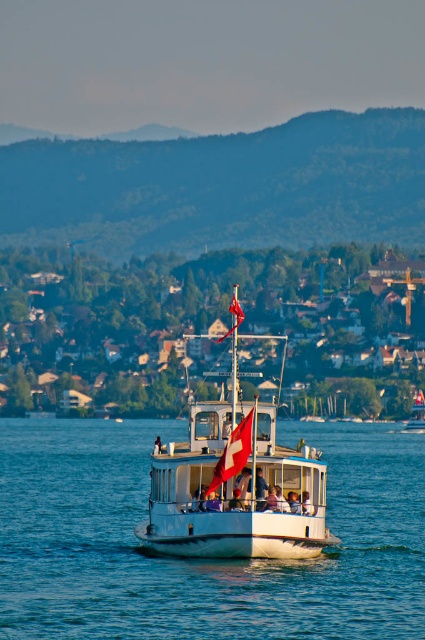
Question: Which of the following is the closest to the observer?

Choices:
 (A) red fabric flag at center
 (B) white glossy boat at center

Answer: (B)

Question: Which object is positioned farthest from the white glossy boat at center?

Choices:
 (A) swiss flag at center
 (B) white wooden town at center
 (C) red fabric flag at center

Answer: (B)

Question: Is white glossy boat at center closer to the viewer compared to red fabric flag at center?

Choices:
 (A) yes
 (B) no

Answer: (A)

Question: Can you confirm if white wooden town at center is positioned above red fabric flag at center?

Choices:
 (A) yes
 (B) no

Answer: (B)

Question: Considering the real-world distances, which object is closest to the red fabric flag at center?

Choices:
 (A) swiss flag at center
 (B) white wooden town at center

Answer: (B)

Question: Is white glossy boat at center smaller than swiss flag at center?

Choices:
 (A) yes
 (B) no

Answer: (B)